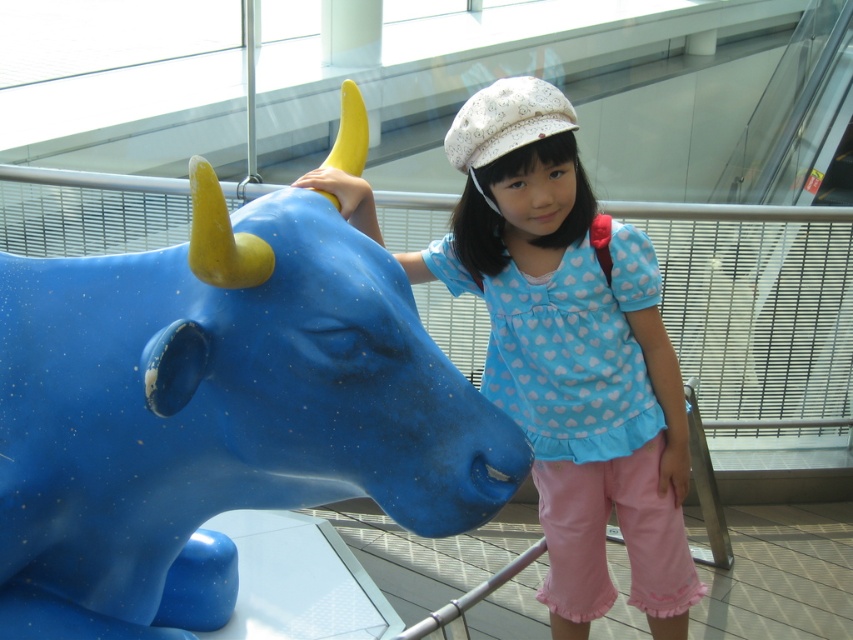
Question: Does blue glossy bull at left appear on the left side of matte blue statue at center?

Choices:
 (A) yes
 (B) no

Answer: (A)

Question: Observing the image, what is the correct spatial positioning of blue glossy bull at left in reference to matte blue statue at center?

Choices:
 (A) above
 (B) below

Answer: (B)

Question: Considering the relative positions of blue glossy bull at left and matte blue statue at center in the image provided, where is blue glossy bull at left located with respect to matte blue statue at center?

Choices:
 (A) above
 (B) below

Answer: (B)

Question: Which point is closer to the camera?

Choices:
 (A) (547, 221)
 (B) (33, 307)

Answer: (B)

Question: Which of the following is the farthest from the observer?

Choices:
 (A) matte blue statue at center
 (B) blue glossy bull at left

Answer: (A)